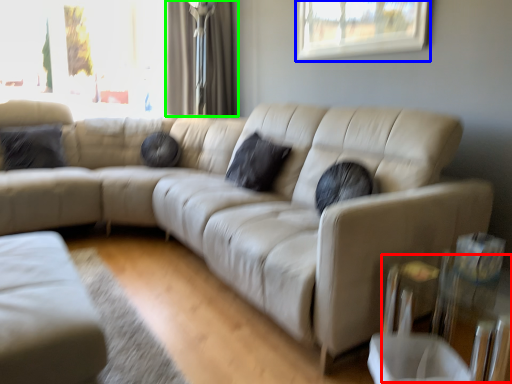
Question: Which is nearer to the glass table (highlighted by a red box)? window (highlighted by a blue box) or curtain (highlighted by a green box).

Choices:
 (A) window
 (B) curtain

Answer: (A)